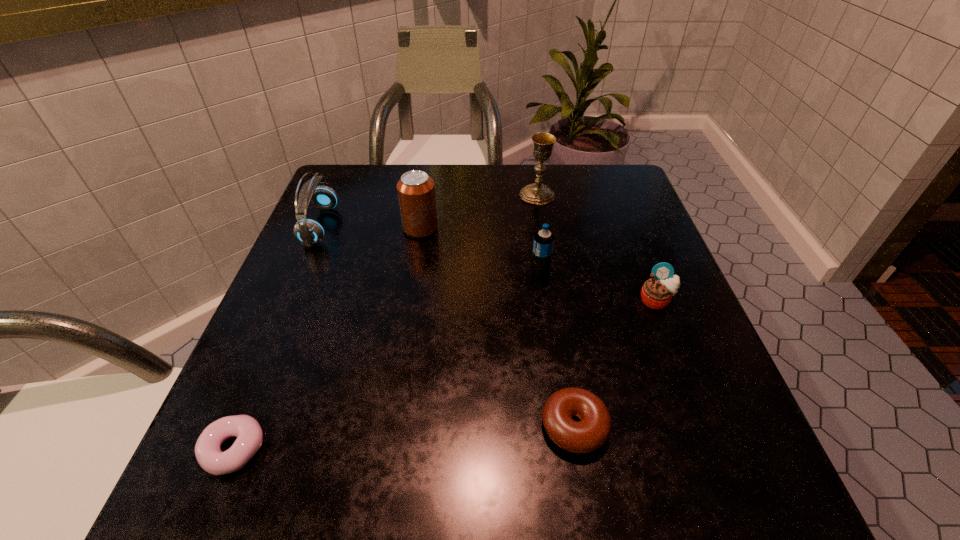
This screenshot has height=540, width=960. I want to click on free space located 0.360m on the left of the chalice, so click(377, 195).

You are a GUI agent. You are given a task and a screenshot of the screen. Output one action in this format:
    pyautogui.click(x=<x>, y=<y>)
    Task: Click on the free space located on the right of the can
    This screenshot has height=540, width=960.
    Given the screenshot: What is the action you would take?
    pyautogui.click(x=593, y=228)

I want to click on free location located 0.150m on the ear cups of the headset, so click(x=398, y=226).

At what (x,y) coordinates should I click in order to perform the action: click on vacant space positioned on the left of the soda bottle. Please return your answer as a coordinate pair (x, y). Looking at the image, I should click on (472, 272).

Where is `vacant region located on the front-facing side of the muffin`? vacant region located on the front-facing side of the muffin is located at coordinates (723, 471).

Where is `free region located 0.220m on the back of the right doughnut`? Image resolution: width=960 pixels, height=540 pixels. free region located 0.220m on the back of the right doughnut is located at coordinates [553, 297].

I want to click on free space located 0.180m on the right of the shortest object, so click(388, 449).

Identify the location of chalice located in the far edge section of the desktop. (537, 193).

I want to click on headset that is positioned at the far edge, so click(x=308, y=231).

The height and width of the screenshot is (540, 960). Identify the location of headset present at the left edge. (308, 231).